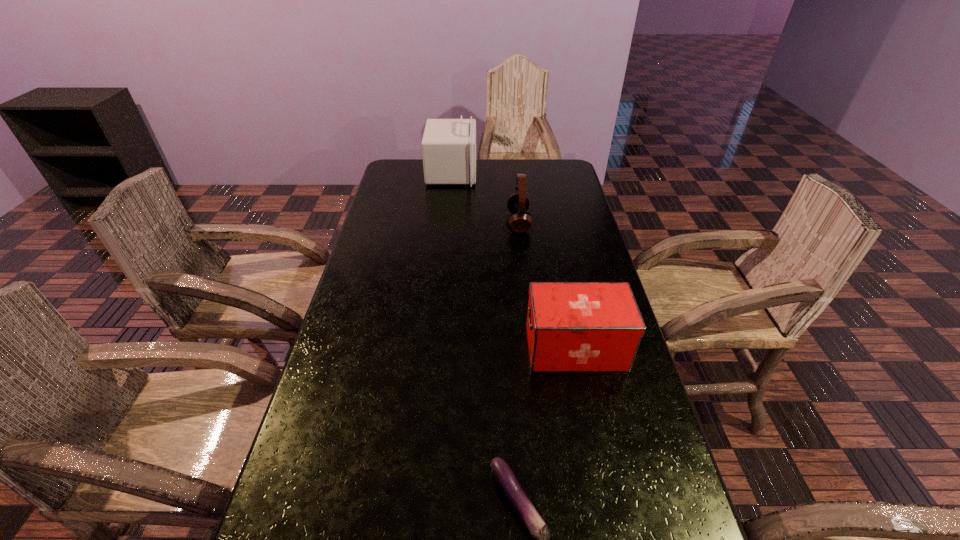
You are a GUI agent. You are given a task and a screenshot of the screen. Output one action in this format:
    pyautogui.click(x=<x>, y=<y>)
    Task: Click on the taller first-aid kit
    
    Given the screenshot: What is the action you would take?
    pyautogui.click(x=449, y=145)

You are a GUI agent. You are given a task and a screenshot of the screen. Output one action in this format:
    pyautogui.click(x=<x>, y=<y>)
    Task: Click on the left first-aid kit
    Image resolution: width=960 pixels, height=540 pixels.
    Given the screenshot: What is the action you would take?
    pyautogui.click(x=449, y=145)

Identify the location of the second farthest object. This screenshot has height=540, width=960. (518, 204).

The width and height of the screenshot is (960, 540). Find the location of `the shorter first-aid kit`. the shorter first-aid kit is located at coordinates (571, 326).

Find the location of a particular element. Image resolution: width=960 pixels, height=540 pixels. the nearer first-aid kit is located at coordinates (571, 326).

Identify the location of free space located on the front-facing side of the left first-aid kit. The image size is (960, 540). (545, 173).

Identify the location of vacant space located on the ear pads of the second farthest object. Image resolution: width=960 pixels, height=540 pixels. (448, 222).

At what (x,y) coordinates should I click in order to perform the action: click on free spot located 0.080m on the ear pads of the second farthest object. Please return your answer as a coordinate pair (x, y). Looking at the image, I should click on (485, 222).

Where is `free spot located on the ear pads of the second farthest object`? free spot located on the ear pads of the second farthest object is located at coordinates (428, 222).

Find the location of a particular element. The height and width of the screenshot is (540, 960). vacant space located on the handle side of the right first-aid kit is located at coordinates (503, 348).